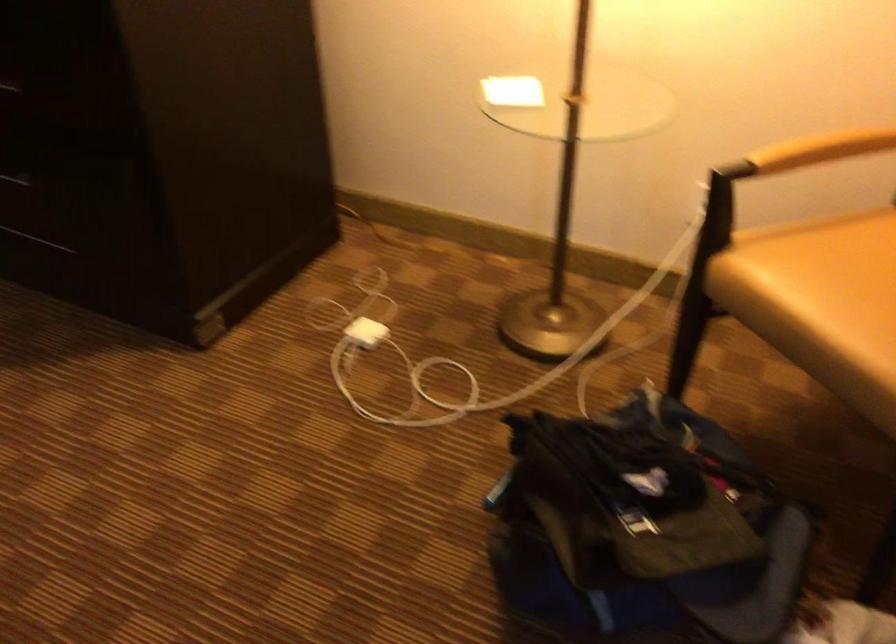
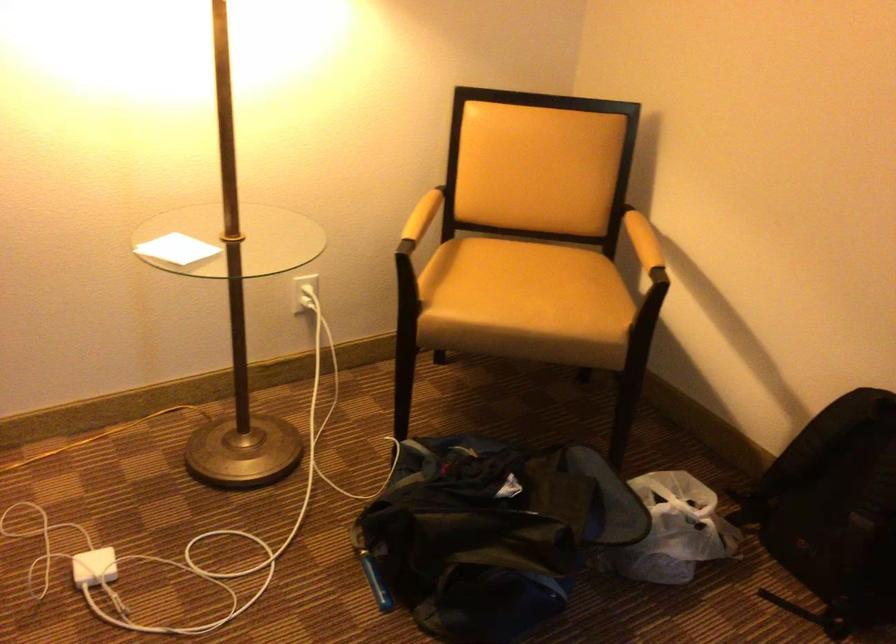
Where in the second image is the point corresponding to pixel 821 149 from the first image?

(437, 216)